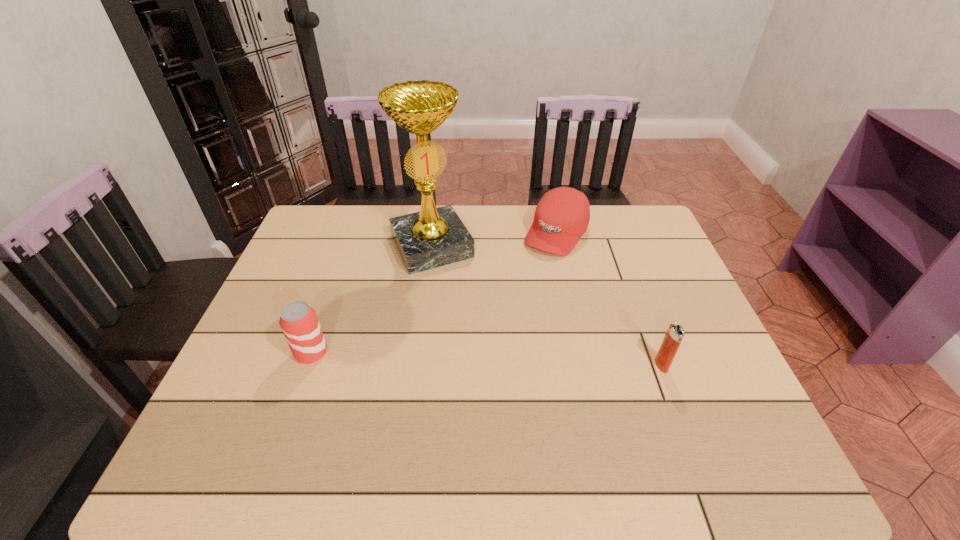
Where is `vacant space at the far left corner of the desktop`? vacant space at the far left corner of the desktop is located at coordinates tap(321, 249).

At what (x,y) coordinates should I click in order to perform the action: click on vacant space at the far right corner of the desktop. Please return your answer as a coordinate pair (x, y). Image resolution: width=960 pixels, height=540 pixels. Looking at the image, I should click on (639, 229).

In order to click on free space between the rightmost object and the beer can in this screenshot , I will do `click(487, 359)`.

This screenshot has width=960, height=540. Find the location of `empty space between the cap and the beer can`. empty space between the cap and the beer can is located at coordinates (434, 293).

This screenshot has width=960, height=540. In order to click on unoccupied area between the tallest object and the leftmost object in this screenshot , I will do `click(372, 300)`.

In order to click on free space between the award and the cap in this screenshot , I will do `click(494, 240)`.

Where is `vacant region between the rightmost object and the tallest object`? The height and width of the screenshot is (540, 960). vacant region between the rightmost object and the tallest object is located at coordinates (547, 306).

At what (x,y) coordinates should I click in order to perform the action: click on free space between the leftmost object and the cap. Please return your answer as a coordinate pair (x, y). The height and width of the screenshot is (540, 960). Looking at the image, I should click on (434, 293).

The image size is (960, 540). Identify the location of free space between the igniter and the second object from left to right. (547, 306).

Where is `free space between the rightmost object and the cap`? The width and height of the screenshot is (960, 540). free space between the rightmost object and the cap is located at coordinates (609, 299).